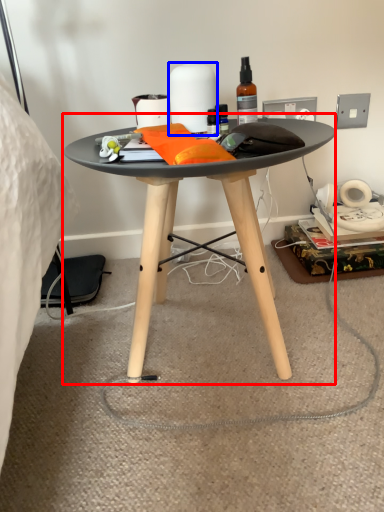
Question: Among these objects, which one is nearest to the camera, coffee table (highlighted by a red box) or toilet paper (highlighted by a blue box)?

Choices:
 (A) coffee table
 (B) toilet paper

Answer: (A)